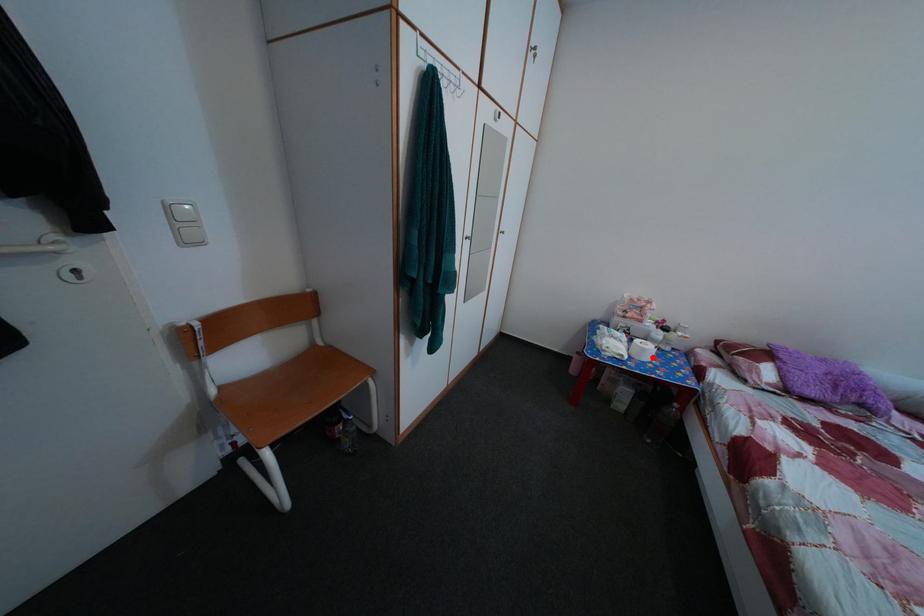
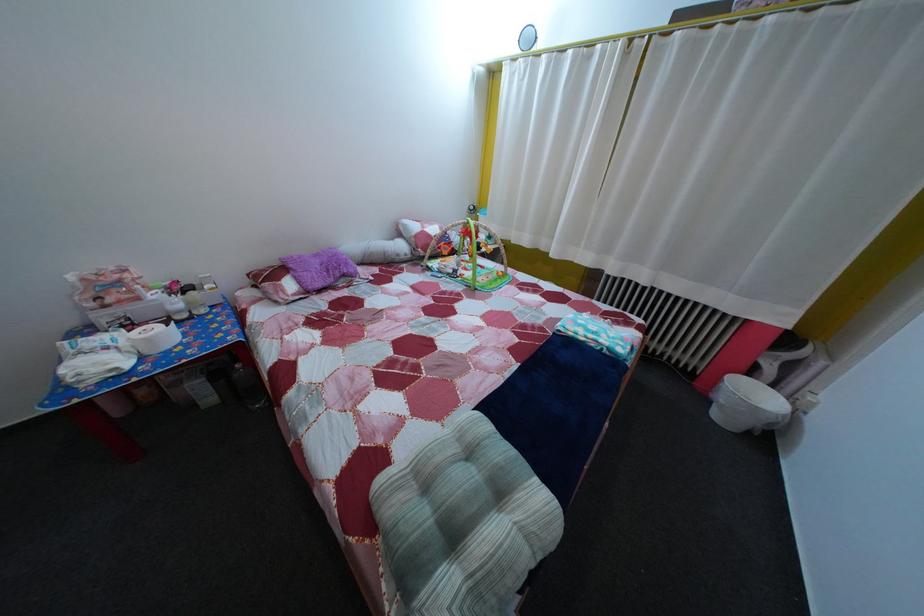
Find the pixel in the second image that matches the highlighted location in the first image.

(157, 347)